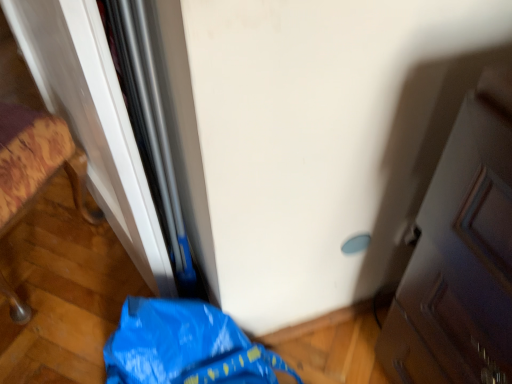
What is the approximate width of wooden chair at left?

41.61 centimeters.

This screenshot has width=512, height=384. Find the location of `wooden chair at left`. wooden chair at left is located at coordinates (34, 162).

What is the approximate height of wooden chair at left?

18.55 inches.

Describe the element at coordinates (34, 162) in the screenshot. The width and height of the screenshot is (512, 384). I see `wooden chair at left` at that location.

Find the location of a particular element. The image size is (512, 384). wooden chair at left is located at coordinates (34, 162).